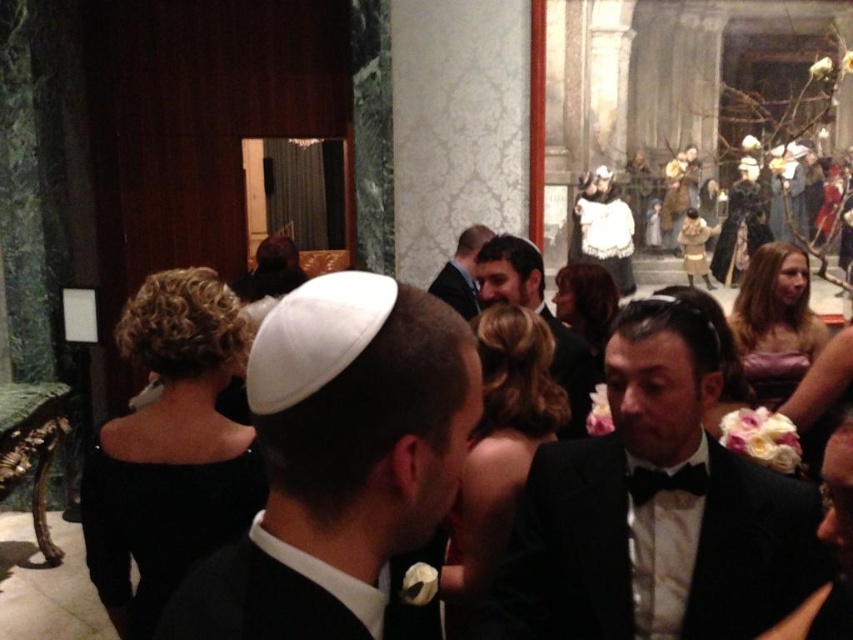
You are a photographer at this event and need to capture a photo of both the black velvet dress at center and the matte black suit at center in the same frame. The camera you are using has a maximum focus range of 10 feet. Can you fit both subjects in the frame without moving the camera?

The distance between the black velvet dress at center and the matte black suit at center is 10.55 feet, which exceeds the camera maximum focus range of 10 feet. Therefore, you cannot fit both subjects in the frame without moving the camera.

You are attending this formal event and need to locate the shiny black suit at center and the black satin bow tie at lower right. From your perspective, which one is more to the left?

The shiny black suit at center is more to the left than the black satin bow tie at lower right.